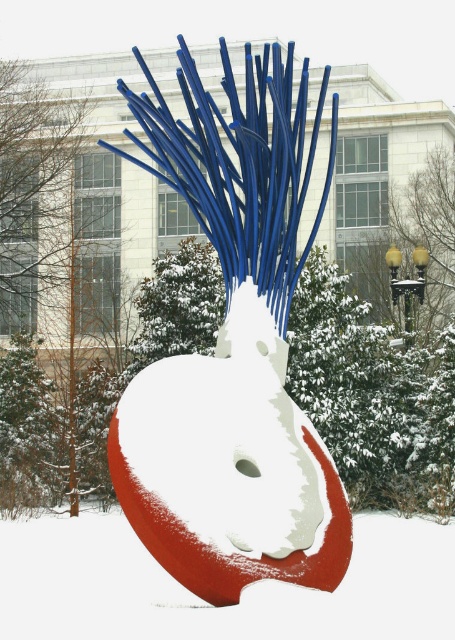
Who is higher up, smooth glossy sculpture at center or smooth red sculpture at center?

smooth glossy sculpture at center

Which is more to the right, smooth glossy sculpture at center or smooth red sculpture at center?

From the viewer's perspective, smooth red sculpture at center appears more on the right side.

Who is more distant from viewer, [238,307] or [28,520]?

The point [28,520] is more distant.

At what (x,y) coordinates should I click in order to perform the action: click on smooth glossy sculpture at center. Please return your answer as a coordinate pair (x, y). This screenshot has height=640, width=455. Looking at the image, I should click on (232, 353).